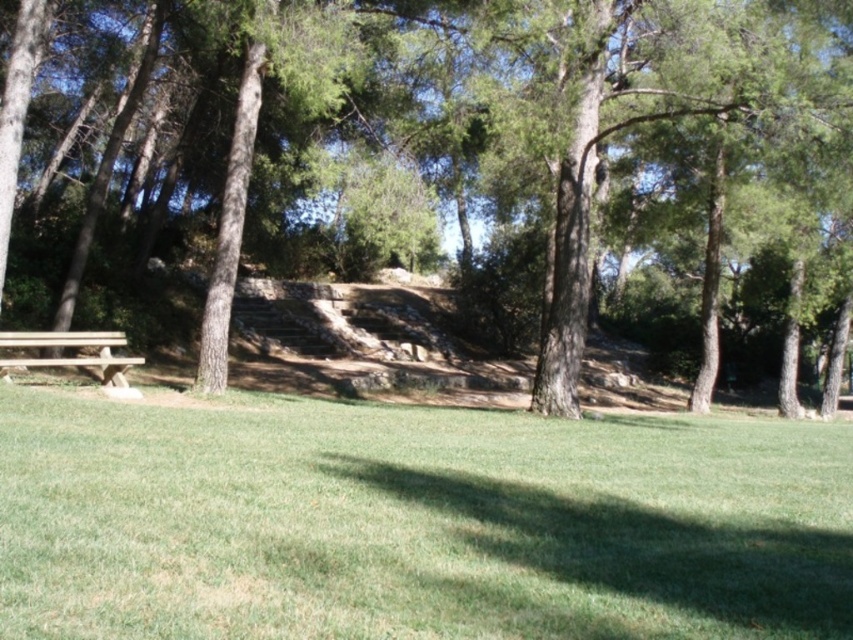
You are a gardener who needs to mow the lawn. You see the green grass at lower center and the wooden bench at lower left. Which area should you mow first to ensure the grass doesn not grow taller than the bench?

The green grass at lower center should be mowed first because it is much taller than the wooden bench at lower left, so it requires immediate attention to prevent it from growing even taller.

You are standing at the point labeled as point [299,100] and want to walk towards the wooden bench partially visible on the left side of the frame. Is the wooden bench closer to you or further away compared to the point labeled as point [183,452]?

The wooden bench partially visible on the left side of the frame is closer to you than the point labeled as point [183,452] because point [183,452] is closer to the viewer than point [299,100], meaning the bench is between you and that point.

You are planning to set up a picnic and need to know the size of the green grass at lower center compared to the brown textured tree at left. Which one is larger?

The brown textured tree at left is larger than the green grass at lower center.